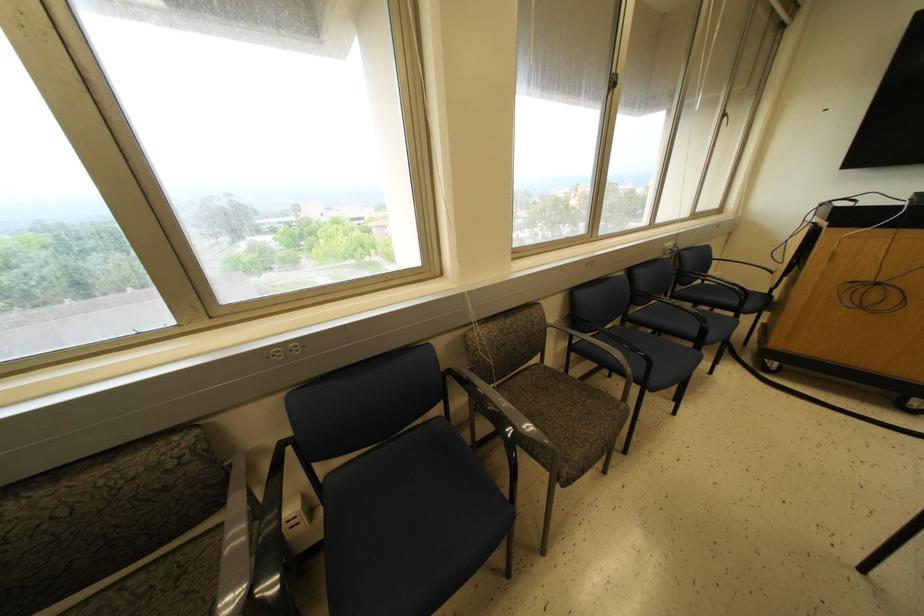
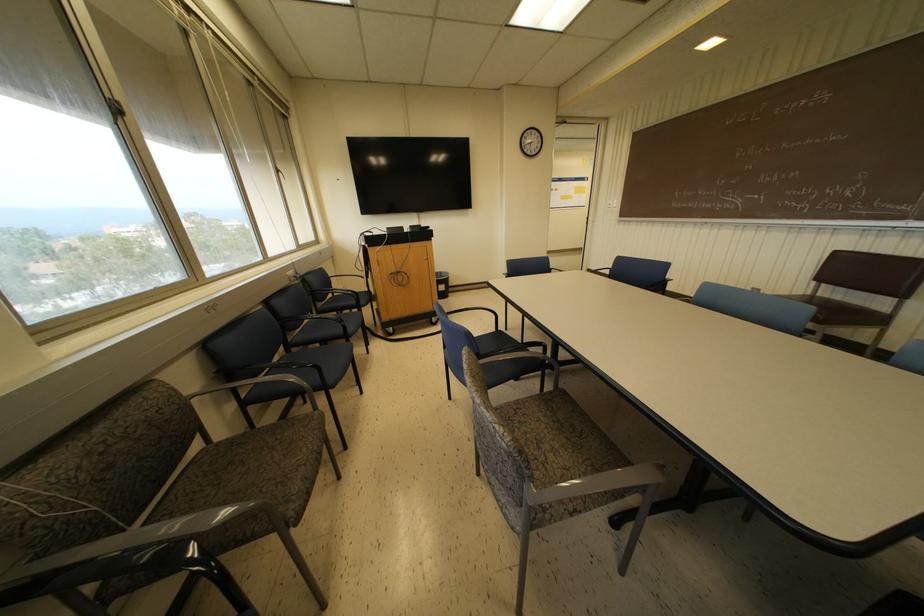
Where in the second image is the point corresponding to pixel 590 262 from the first image?

(209, 307)